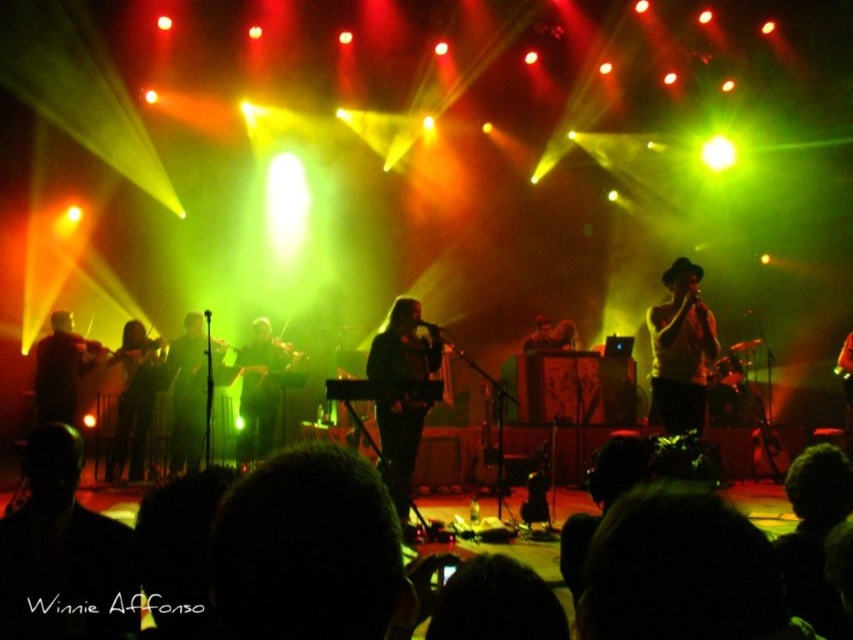
You are a stagehand preparing to adjust the lighting. You need to know which object is larger to position the spotlight correctly. Which is bigger, the shiny black microphone at center or the black fabric guitar at left?

The shiny black microphone at center is bigger than the black fabric guitar at left, so the spotlight should be positioned accordingly.